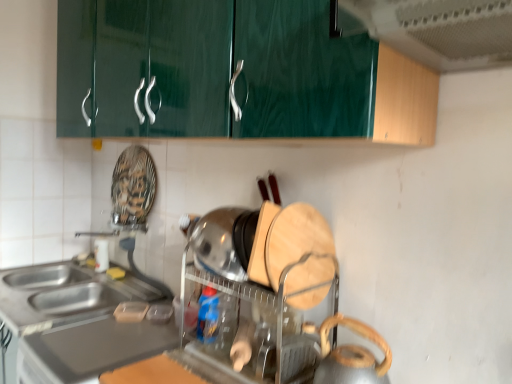
Question: From the image's perspective, is metallic silver kettle at lower right, which ranks as the first appliance in front-to-back order, located above satin silver countertop at lower left?

Choices:
 (A) yes
 (B) no

Answer: (A)

Question: From a real-world perspective, does metallic silver kettle at lower right, arranged as the 2th appliance when viewed from the back, sit lower than satin silver countertop at lower left?

Choices:
 (A) yes
 (B) no

Answer: (B)

Question: Is metallic silver kettle at lower right, arranged as the 2th appliance when viewed from the back, facing away from satin silver countertop at lower left?

Choices:
 (A) no
 (B) yes

Answer: (A)

Question: Can we say metallic silver kettle at lower right, arranged as the 2th appliance when viewed from the back, lies outside satin silver countertop at lower left?

Choices:
 (A) no
 (B) yes

Answer: (B)

Question: Can you confirm if metallic silver kettle at lower right, arranged as the 2th appliance when viewed from the back, is shorter than satin silver countertop at lower left?

Choices:
 (A) yes
 (B) no

Answer: (B)

Question: Is metallic silver kettle at lower right, which ranks as the first appliance in front-to-back order, to the left of satin silver countertop at lower left from the viewer's perspective?

Choices:
 (A) yes
 (B) no

Answer: (B)

Question: Is metallic silver kettle at lower right, arranged as the 2th appliance when viewed from the back, wider than green glossy exhaust hood at upper center?

Choices:
 (A) yes
 (B) no

Answer: (B)

Question: Is metallic silver kettle at lower right, arranged as the 2th appliance when viewed from the back, at the left side of green glossy exhaust hood at upper center?

Choices:
 (A) no
 (B) yes

Answer: (B)

Question: Is metallic silver kettle at lower right, arranged as the 2th appliance when viewed from the back, bigger than green glossy exhaust hood at upper center?

Choices:
 (A) yes
 (B) no

Answer: (B)

Question: From a real-world perspective, is metallic silver kettle at lower right, arranged as the 2th appliance when viewed from the back, under green glossy exhaust hood at upper center?

Choices:
 (A) no
 (B) yes

Answer: (B)

Question: Is there a large distance between metallic silver kettle at lower right, which ranks as the first appliance in front-to-back order, and green glossy exhaust hood at upper center?

Choices:
 (A) yes
 (B) no

Answer: (B)

Question: From the image's perspective, does metallic silver kettle at lower right, which ranks as the first appliance in front-to-back order, appear lower than green glossy exhaust hood at upper center?

Choices:
 (A) yes
 (B) no

Answer: (A)

Question: From a real-world perspective, is satin silver countertop at lower left beneath metallic silver kettle at lower right, arranged as the 2th appliance when viewed from the back?

Choices:
 (A) yes
 (B) no

Answer: (A)